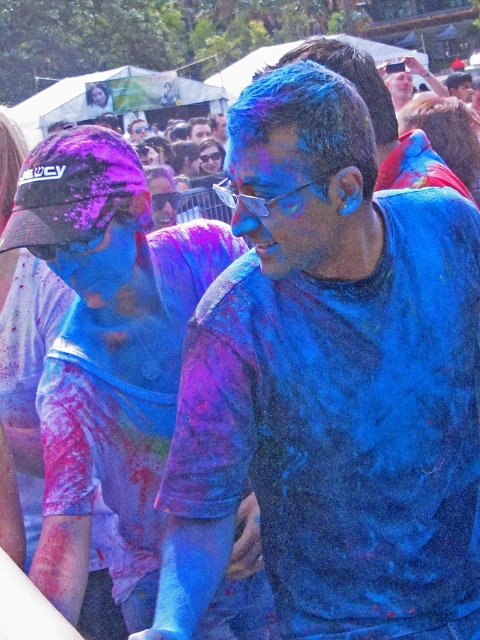
Between point (300, 108) and point (427, 145), which one is positioned in front?

Positioned in front is point (300, 108).

Which is in front, point (259, 269) or point (387, 115)?

Point (259, 269) is more forward.

At what (x,y) coordinates should I click in order to perform the action: click on blue matte shirt at center. Please return your answer as a coordinate pair (x, y). Image resolution: width=480 pixels, height=640 pixels. Looking at the image, I should click on (330, 384).

Does matte blue shirt at center appear over blue matte face paint at center?

No.

Who is taller, matte blue shirt at center or blue matte face paint at center?

matte blue shirt at center

Locate an element on the screen. matte blue shirt at center is located at coordinates (108, 353).

This screenshot has width=480, height=640. Identify the location of matte blue shirt at center. (108, 353).

Which of these two, blue matte shirt at center or matte blue shirt at center, stands shorter?

blue matte shirt at center

Is blue matte shirt at center thinner than matte blue shirt at center?

Indeed, blue matte shirt at center has a lesser width compared to matte blue shirt at center.

Is point (310, 532) positioned after point (166, 460)?

That is False.

Locate an element on the screen. The width and height of the screenshot is (480, 640). blue matte shirt at center is located at coordinates pos(330,384).